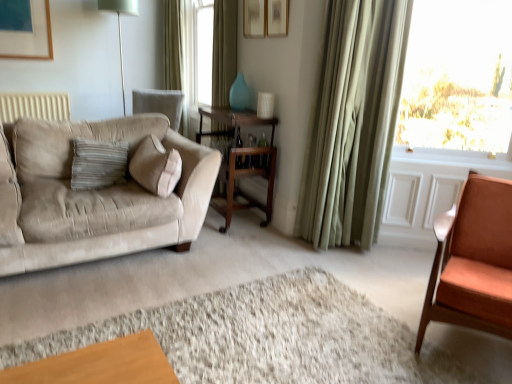
You are a GUI agent. You are given a task and a screenshot of the screen. Output one action in this format:
    pyautogui.click(x=<x>, y=<y>)
    Task: Click on the matte orange chair at right
    
    Given the screenshot: What is the action you would take?
    pyautogui.click(x=474, y=261)

Measure the distance between point (213, 25) and camera.

A distance of 3.71 meters exists between point (213, 25) and camera.

Locate an element on the screen. The image size is (512, 384). green fabric curtain at center, placed as the 2th curtain when sorted from back to front is located at coordinates (224, 51).

What are the coordinates of `green fabric curtain at upper center, which is counted as the 1th curtain, starting from the left` in the screenshot? It's located at (173, 44).

Locate an element on the screen. The width and height of the screenshot is (512, 384). matte orange chair at right is located at coordinates (474, 261).

Is green fabric curtain at upper center, acting as the first curtain starting from the back, not close to teal glass vase at center?

That's right, there is a large distance between green fabric curtain at upper center, acting as the first curtain starting from the back, and teal glass vase at center.

Considering the sizes of objects green fabric curtain at upper center, acting as the first curtain starting from the back, and teal glass vase at center in the image provided, who is smaller, green fabric curtain at upper center, acting as the first curtain starting from the back, or teal glass vase at center?

With smaller size is teal glass vase at center.

Which object is further away from the camera, green fabric curtain at upper center, which appears as the 3th curtain when viewed from the front, or teal glass vase at center?

green fabric curtain at upper center, which appears as the 3th curtain when viewed from the front, is further away from the camera.

From the picture: From the image's perspective, which is above, green fabric curtain at upper center, acting as the first curtain starting from the back, or teal glass vase at center?

green fabric curtain at upper center, acting as the first curtain starting from the back, appears higher in the image.

Which object is positioned more to the left, teal glass vase at center or wooden cocktail table at center?

Positioned to the left is wooden cocktail table at center.

Does teal glass vase at center turn towards wooden cocktail table at center?

No, teal glass vase at center is not aimed at wooden cocktail table at center.

Locate an element on the screen. Image resolution: width=512 pixels, height=384 pixels. vase that appears on the right of wooden cocktail table at center is located at coordinates (239, 94).

From the image's perspective, is teal glass vase at center below wooden cocktail table at center?

Incorrect, from the image's perspective, teal glass vase at center is higher than wooden cocktail table at center.

From the image's perspective, is wooden cocktail table at center on top of smooth orange chair at right?

Indeed, from the image's perspective, wooden cocktail table at center is shown above smooth orange chair at right.

Is wooden cocktail table at center next to smooth orange chair at right and touching it?

No.

Looking at this image, is wooden cocktail table at center wider than smooth orange chair at right?

No.

Does wooden cocktail table at center have a larger size compared to smooth orange chair at right?

Yes.

Between smooth orange chair at right and beige suede couch at left, which one has more height?

beige suede couch at left.

From a real-world perspective, which is physically above, smooth orange chair at right or beige suede couch at left?

beige suede couch at left, from a real-world perspective.

Can you see smooth orange chair at right touching beige suede couch at left?

smooth orange chair at right and beige suede couch at left are clearly separated.

Can you tell me how much smooth orange chair at right and beige suede couch at left differ in facing direction?

The angle between the facing direction of smooth orange chair at right and the facing direction of beige suede couch at left is 179 degrees.

Is teal glass vase at center aimed at green fabric curtain at center, placed as the 2th curtain when sorted from back to front?

No, teal glass vase at center does not turn towards green fabric curtain at center, placed as the 2th curtain when sorted from back to front.

Considering the positions of objects teal glass vase at center and green fabric curtain at center, which is the 2th curtain from left to right, in the image provided, who is more to the left, teal glass vase at center or green fabric curtain at center, which is the 2th curtain from left to right,?

From the viewer's perspective, green fabric curtain at center, which is the 2th curtain from left to right, appears more on the left side.

Who is taller, teal glass vase at center or green fabric curtain at center, placed as the 2th curtain when sorted from back to front?

Standing taller between the two is green fabric curtain at center, placed as the 2th curtain when sorted from back to front.

How much distance is there between teal glass vase at center and green fabric curtain at upper center, which appears as the 3th curtain when viewed from the front?

teal glass vase at center and green fabric curtain at upper center, which appears as the 3th curtain when viewed from the front, are 2.15 meters apart from each other.

Based on their positions, is teal glass vase at center located to the left or right of green fabric curtain at upper center, which is counted as the 1th curtain, starting from the left?

Clearly, teal glass vase at center is on the right of green fabric curtain at upper center, which is counted as the 1th curtain, starting from the left, in the image.

From the image's perspective, which one is positioned lower, teal glass vase at center or green fabric curtain at upper center, acting as the first curtain starting from the back?

teal glass vase at center.

This screenshot has width=512, height=384. Identify the location of vase in front of the green fabric curtain at upper center, marked as the third curtain in a right-to-left arrangement. (239, 94).

Who is bigger, transparent glass window at upper right or matte white picture frame at upper center?

transparent glass window at upper right is bigger.

Image resolution: width=512 pixels, height=384 pixels. What are the coordinates of `picture frame behind the transparent glass window at upper right` in the screenshot? It's located at (277, 18).

From a real-world perspective, is transparent glass window at upper right physically below matte white picture frame at upper center?

Yes, from a real-world perspective, transparent glass window at upper right is under matte white picture frame at upper center.

This screenshot has width=512, height=384. There is a teal glass vase at center. What are the coordinates of `the 2nd curtain above it (from a real-world perspective)` in the screenshot? It's located at (173, 44).

At what (x,y) coordinates should I click in order to perform the action: click on vase behind the wooden cocktail table at center. Please return your answer as a coordinate pair (x, y). This screenshot has height=384, width=512. Looking at the image, I should click on (239, 94).

Looking at the image, which one is located closer to green fabric curtain at right, the first curtain positioned from the front, green fabric curtain at center, which ranks as the second curtain in front-to-back order, or metallic silver table lamp at upper left?

green fabric curtain at center, which ranks as the second curtain in front-to-back order, is positioned closer to the anchor green fabric curtain at right, the first curtain positioned from the front.

When comparing their distances from metallic silver table lamp at upper left, does wooden table at center or matte orange chair at right seem further?

matte orange chair at right lies further to metallic silver table lamp at upper left than the other object.

From the image, which object appears to be nearer to smooth orange chair at right, matte white picture frame at upper center or beige suede couch at left?

Among the two, beige suede couch at left is located nearer to smooth orange chair at right.

From the image, which object appears to be nearer to metallic silver table lamp at upper left, beige suede couch at left or green fabric curtain at center, which is the 2th curtain from left to right?

green fabric curtain at center, which is the 2th curtain from left to right, is positioned closer to the anchor metallic silver table lamp at upper left.

Considering their positions, is teal glass vase at center positioned further to beige suede couch at left than transparent glass window at upper right?

transparent glass window at upper right is further to beige suede couch at left.

Based on their spatial positions, is green fabric curtain at upper center, which is counted as the 1th curtain, starting from the left, or green fabric curtain at right, marked as the 1th curtain in a right-to-left arrangement, closer to wooden cocktail table at center?

green fabric curtain at right, marked as the 1th curtain in a right-to-left arrangement.

Based on their spatial positions, is green fabric curtain at right, which is the third curtain in back-to-front order, or green fabric curtain at center, which ranks as the second curtain in front-to-back order, further from smooth orange chair at right?

green fabric curtain at center, which ranks as the second curtain in front-to-back order, is further to smooth orange chair at right.

Which object lies nearer to the anchor point matte white picture frame at upper center, teal glass vase at center or smooth orange chair at right?

Among the two, teal glass vase at center is located nearer to matte white picture frame at upper center.

Locate an element on the screen. window positioned between smooth orange chair at right and metallic silver table lamp at upper left from near to far is located at coordinates (458, 76).

Locate an element on the screen. picture frame between green fabric curtain at upper center, which is counted as the 1th curtain, starting from the left, and wooden table at center, in the vertical direction is located at coordinates (277, 18).

Where is `chair between smooth orange chair at right and wooden cocktail table at center from front to back`? Image resolution: width=512 pixels, height=384 pixels. chair between smooth orange chair at right and wooden cocktail table at center from front to back is located at coordinates (474, 261).

What are the coordinates of `table located between metallic silver table lamp at upper left and matte white picture frame at upper center in the left-right direction` in the screenshot? It's located at (245, 176).